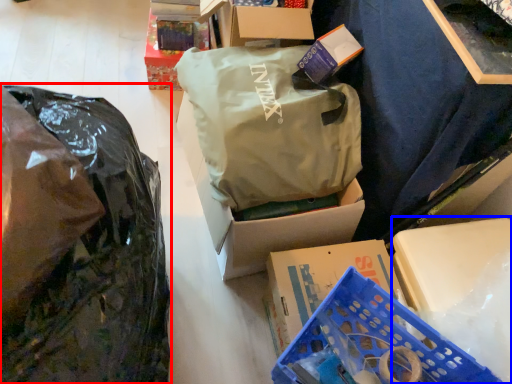
Question: Which point is further to the camera, plastic bag (highlighted by a red box) or storage box (highlighted by a blue box)?

Choices:
 (A) plastic bag
 (B) storage box

Answer: (B)